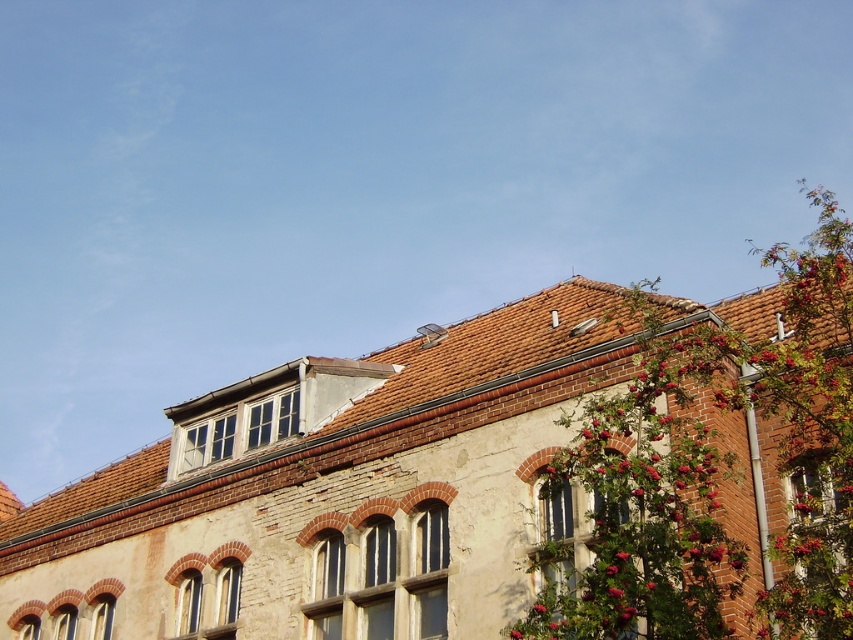
Question: Which of these objects is positioned closest to the white stone window at center?

Choices:
 (A) matte glass window at center
 (B) clear glass window at upper center

Answer: (B)

Question: Is brown stone window at center positioned at the back of white stone window at center?

Choices:
 (A) yes
 (B) no

Answer: (B)

Question: Is matte glass window at center bigger than clear glass window at upper center?

Choices:
 (A) yes
 (B) no

Answer: (A)

Question: Among these points, which one is farthest from the camera?

Choices:
 (A) (282, 410)
 (B) (403, 550)
 (C) (614, 522)
 (D) (222, 632)

Answer: (A)

Question: Is matte glass window at center below white stone window at center?

Choices:
 (A) no
 (B) yes

Answer: (A)

Question: Which object appears farthest from the camera in this image?

Choices:
 (A) clear glass window at upper center
 (B) brown stone window at center
 (C) white stone window at center
 (D) matte glass window at center

Answer: (A)